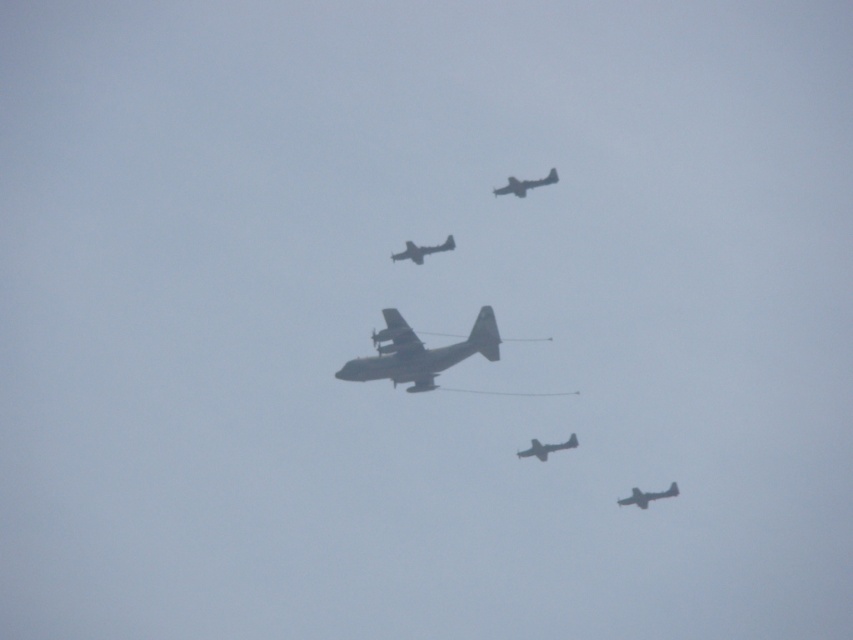
Question: Which object is the farthest from the matte gray airplane at upper center?

Choices:
 (A) metallic gray airplane at lower right
 (B) matte gray airplane at center

Answer: (A)

Question: Which point is closer to the camera taking this photo?

Choices:
 (A) (624, 499)
 (B) (521, 179)
 (C) (408, 243)

Answer: (B)

Question: Which is nearer to the matte gray airplane at upper center?

Choices:
 (A) gray matte cargo plane at center
 (B) matte gray airplane at center
 (C) metallic gray airplane at lower right
 (D) metallic gray airplane at center

Answer: (D)

Question: Is metallic gray airplane at center to the right of matte gray airplane at upper center from the viewer's perspective?

Choices:
 (A) yes
 (B) no

Answer: (B)

Question: Does metallic gray airplane at center appear under matte gray airplane at upper center?

Choices:
 (A) no
 (B) yes

Answer: (B)

Question: Can you confirm if matte gray airplane at upper center is positioned to the right of metallic gray airplane at lower right?

Choices:
 (A) no
 (B) yes

Answer: (A)